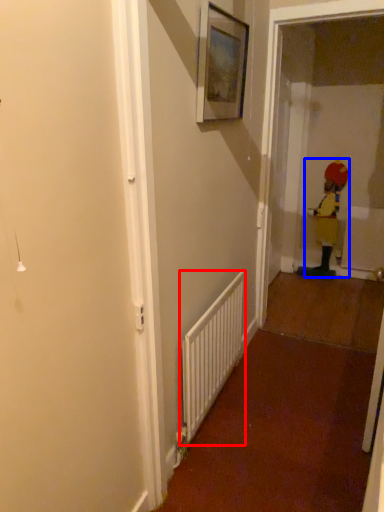
Question: Which object is closer to the camera taking this photo, radiator (highlighted by a red box) or toddler (highlighted by a blue box)?

Choices:
 (A) radiator
 (B) toddler

Answer: (A)